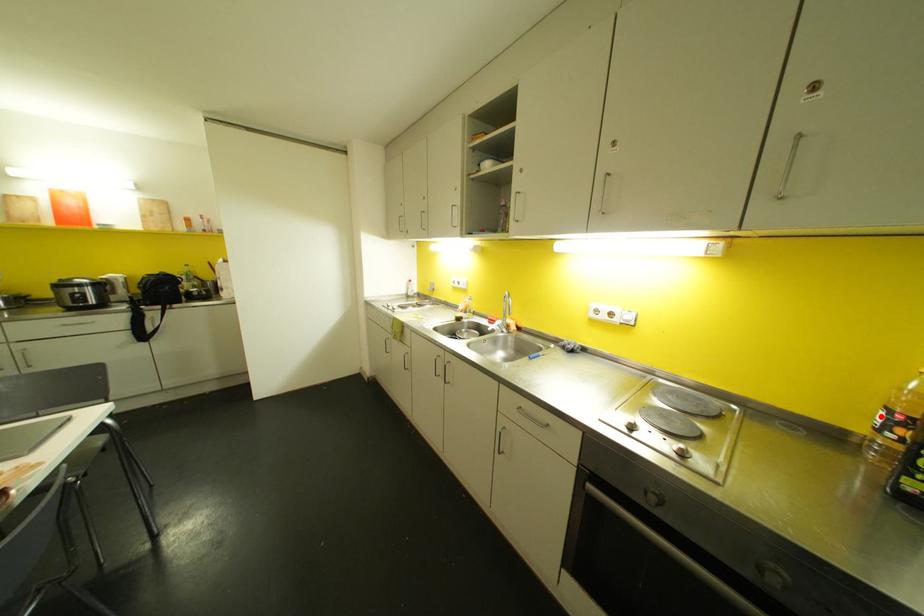
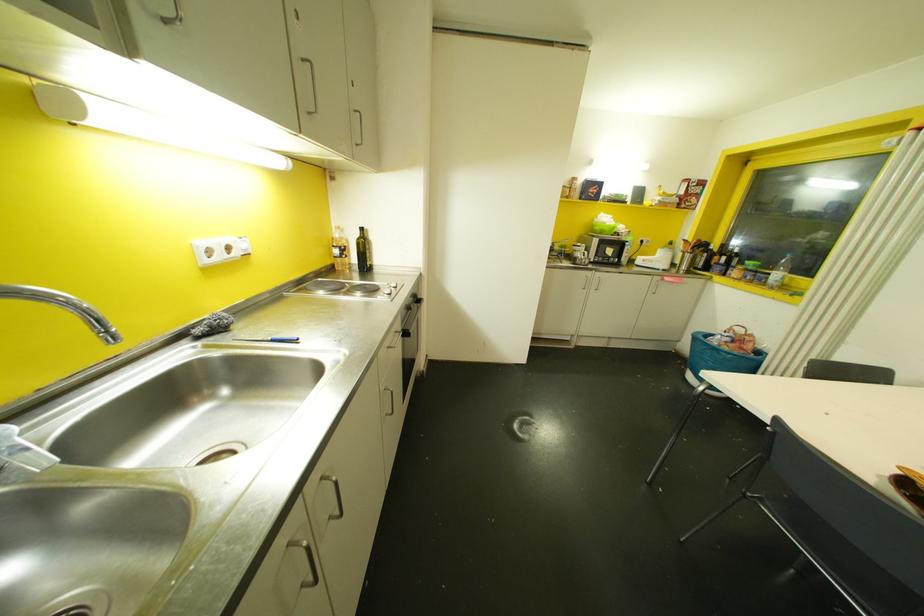
The point at the highlighted location is marked in the first image. Where is the corresponding point in the second image?

(335, 251)